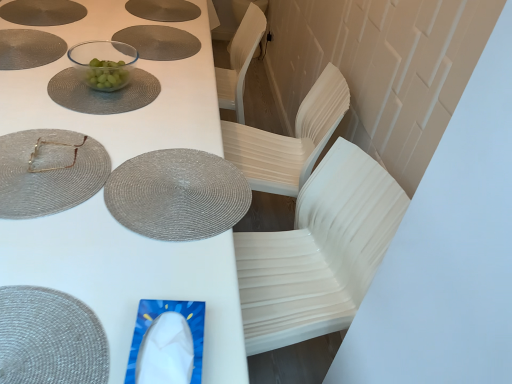
The image size is (512, 384). In order to click on free space between matte gray placemat at upper center, which appears as the 2th plate when viewed from the left, and clear glass bowl at upper center, placed as the fourth tableware when sorted from bottom to top in this screenshot , I will do `click(133, 63)`.